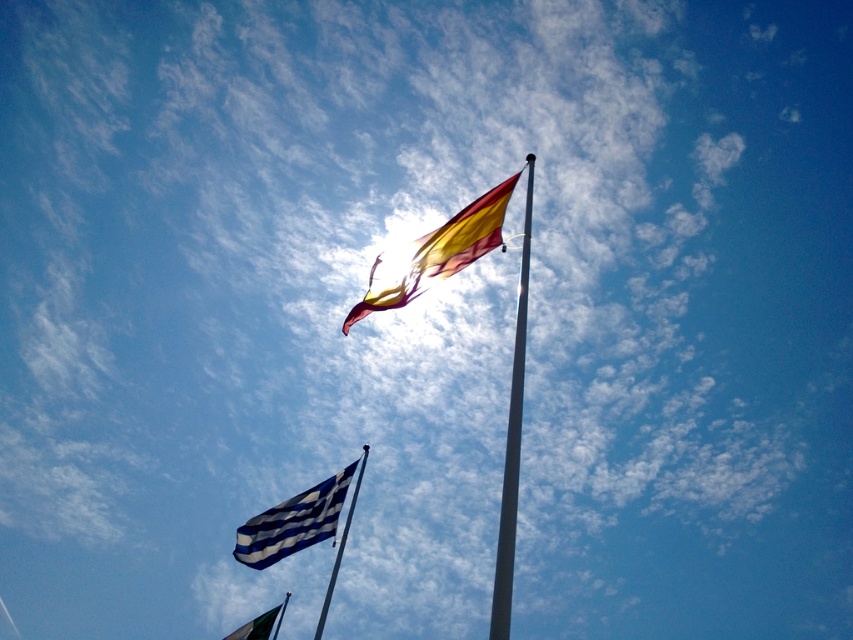
You are standing in the middle of the field looking at the two flagpoles. There are two points marked on the ground in front of you at coordinates point [515,476] and point [352,497]. Which point is closer to you?

Point [515,476] is closer to the camera than point [352,497], so the point [515,476] is closer to you.